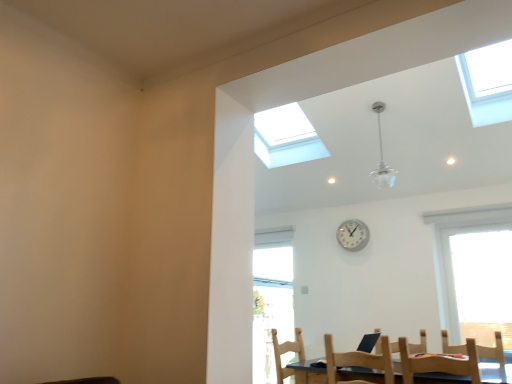
The width and height of the screenshot is (512, 384). Find the location of `empty space that is ontop of white plastic clock at center (from a real-world perspective)`. empty space that is ontop of white plastic clock at center (from a real-world perspective) is located at coordinates (352, 213).